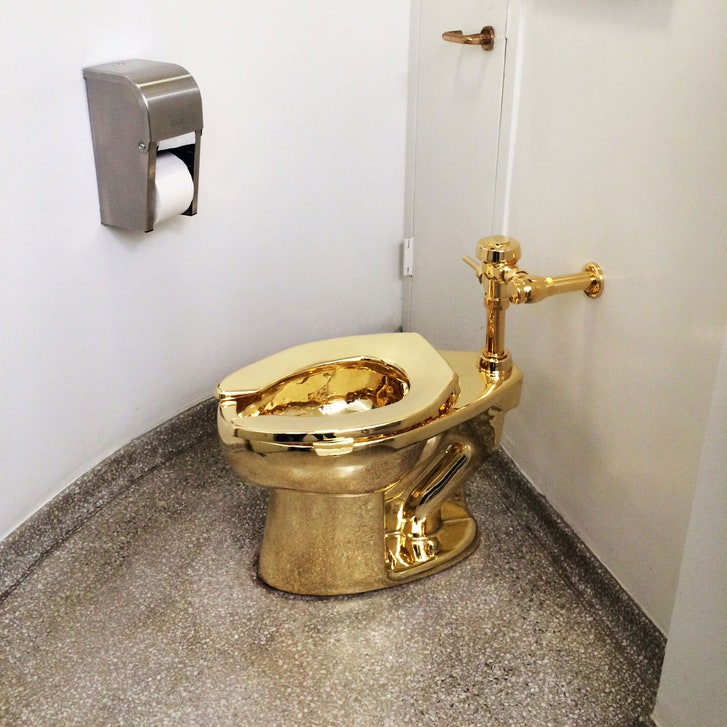
The height and width of the screenshot is (727, 727). In order to click on toilet seat in this screenshot , I will do `click(416, 414)`.